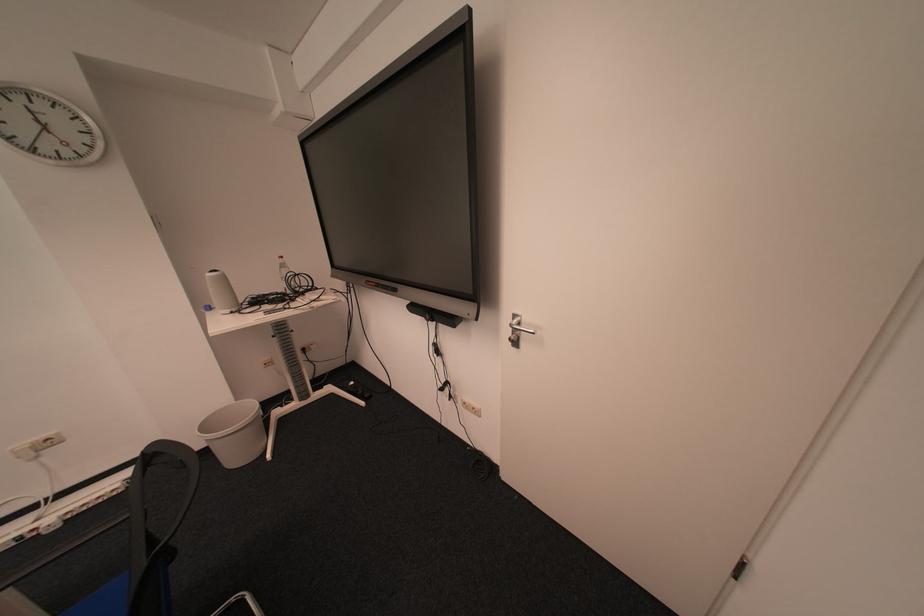
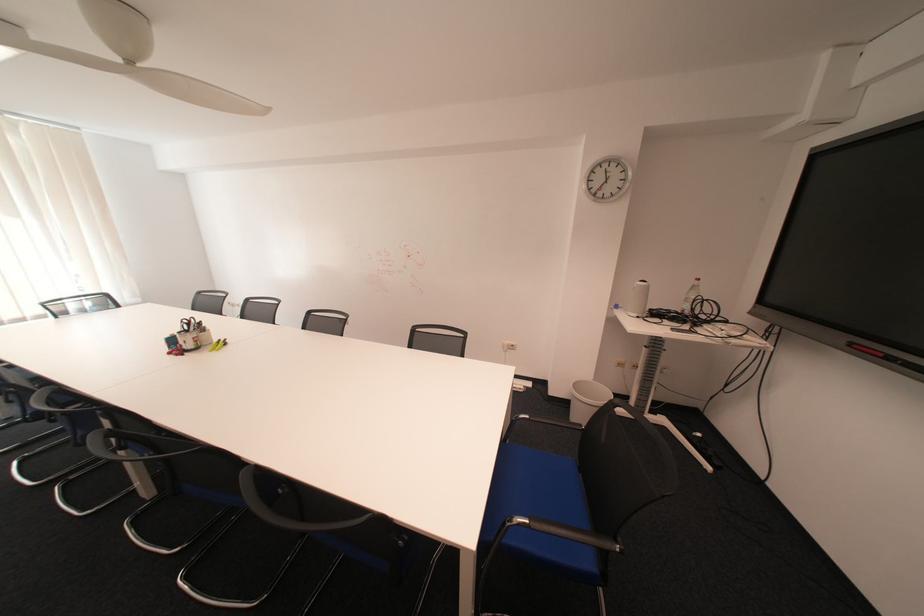
Question: The images are taken continuously from a first-person perspective. In which direction is your viewpoint rotating?

Choices:
 (A) Left
 (B) Right
 (C) Up
 (D) Down

Answer: (A)